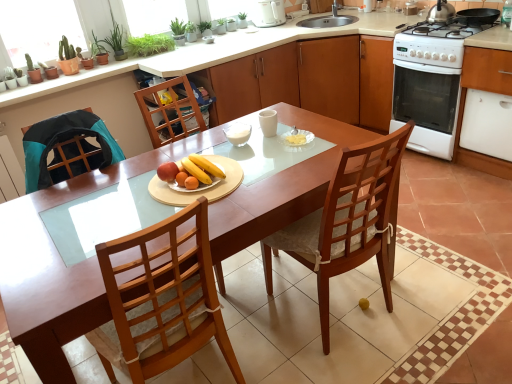
At what (x,y) coordinates should I click in order to perform the action: click on spots to the right of wooden chair at center. Please return your answer as a coordinate pair (x, y). The image size is (512, 384). Looking at the image, I should click on (442, 291).